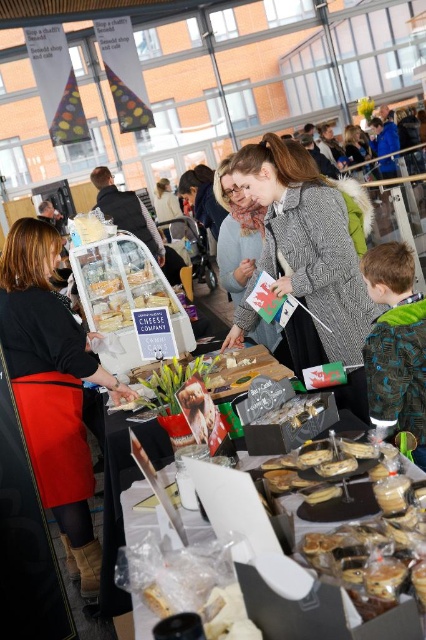
You are a photographer at the market stall and want to take a photo of both the matte black apron at left and the matte gray sweater at center. Which object will appear closer to the camera in the photo?

The matte black apron at left will appear closer to the camera in the photo because it is positioned in front of the matte gray sweater at center.

You are a customer at the market stall and want to locate the translucent plastic cheese at center. According to the stall layout, where would you find it?

The translucent plastic cheese at center is located at the 2D coordinates point (120, 291) on the stall layout.

You are at the market stall and want to reach the item located at point (x=308, y=496). There is an obstacle at point (x=131, y=266). Can you go around it to reach your destination?

Point (x=131, y=266) is behind point (x=308, y=496), so you can go around the obstacle at point (x=131, y=266) to reach the destination at point (x=308, y=496).